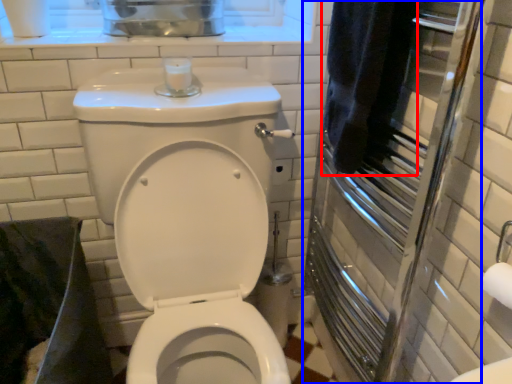
Question: Which of the following is the farthest to the observer, bath towel (highlighted by a red box) or screen door (highlighted by a blue box)?

Choices:
 (A) bath towel
 (B) screen door

Answer: (A)